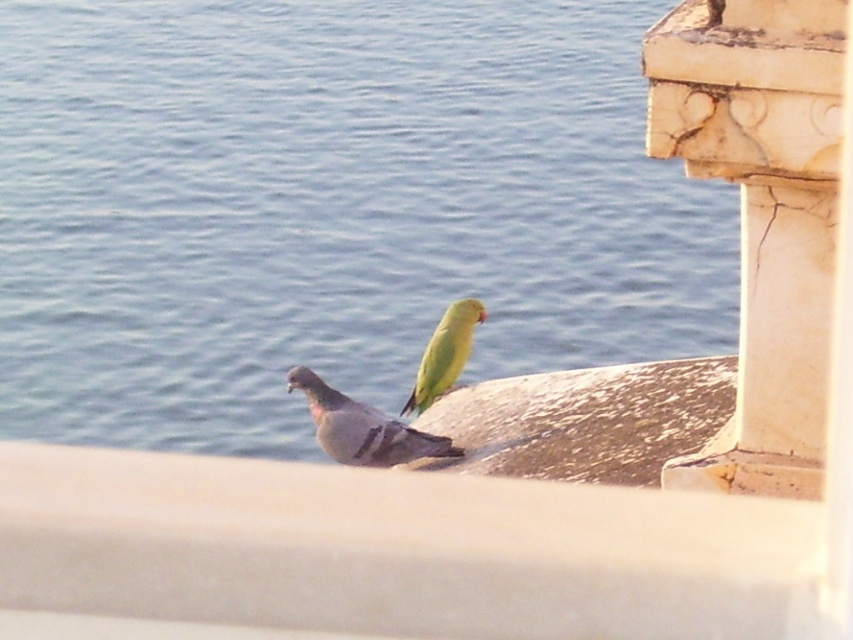
You are a birdwatcher standing in front of the stone ledge where the gray matte pigeon at center and the green matte parrot at center are perched. Which bird would appear larger to you?

The gray matte pigeon at center would appear larger because it is closer to the viewer than the green matte parrot at center.

You are a bird enthusiast observing the scene. You notice the white marble pillar at upper right and the gray matte pigeon at center. Which object occupies more space in the image?

The white marble pillar at upper right is larger in size than the gray matte pigeon at center, so it occupies more space in the image.

You are a bird watching enthusiast standing at the edge of the water. You notice the blue water at center and the white marble pillar at upper right. How far apart are these two landmarks?

The blue water at center is 4.56 meters away from the white marble pillar at upper right.